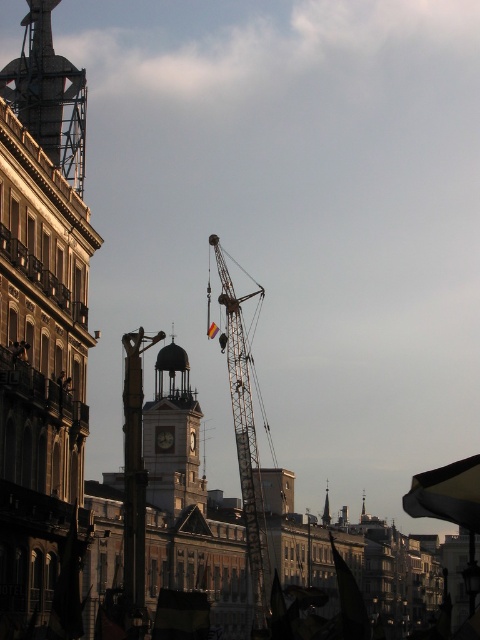
You are a GUI agent. You are given a task and a screenshot of the screen. Output one action in this format:
    pyautogui.click(x=<x>, y=<y>)
    Task: Click on the metallic scaffolding at upper left
    
    Given the screenshot: What is the action you would take?
    pyautogui.click(x=48, y=93)

Is metallic scaffolding at upper left further to camera compared to white glossy clock at center?

No, metallic scaffolding at upper left is in front of white glossy clock at center.

Between point (20, 60) and point (157, 440), which one is positioned in front?

Point (20, 60)

I want to click on metallic scaffolding at upper left, so click(x=48, y=93).

Which is more to the right, matte gray clock tower at center or metallic gray crane at center?

metallic gray crane at center is more to the right.

Is point (191, 472) farther from camera compared to point (252, 589)?

No, it is in front of (252, 589).

Where is `matte gray clock tower at center`? The image size is (480, 640). matte gray clock tower at center is located at coordinates [175, 435].

Can you confirm if matte gray clock tower at center is bigger than white glossy clock at center?

Yes, matte gray clock tower at center is bigger than white glossy clock at center.

Looking at this image, does matte gray clock tower at center appear on the right side of white glossy clock at center?

Yes, matte gray clock tower at center is to the right of white glossy clock at center.

Between point (180, 394) and point (162, 429), which one is positioned in front?

Point (162, 429) is more forward.

Locate an element on the screen. The image size is (480, 640). matte gray clock tower at center is located at coordinates (175, 435).